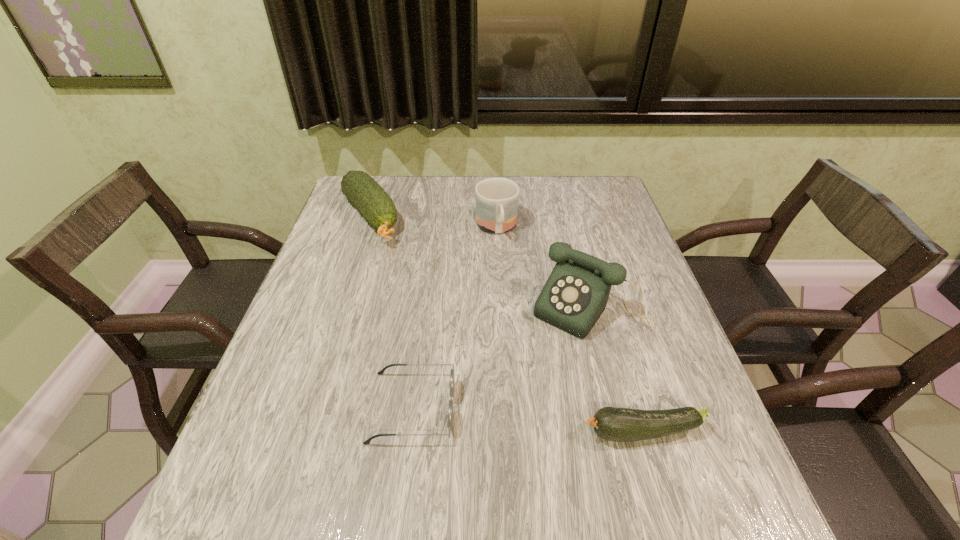
This screenshot has width=960, height=540. I want to click on the fourth object from right to left, so click(x=452, y=374).

Image resolution: width=960 pixels, height=540 pixels. Identify the location of zucchini. (617, 424).

Locate an element on the screen. The height and width of the screenshot is (540, 960). the third object from left to right is located at coordinates [496, 199].

In order to click on the fourth shortest object in this screenshot , I will do `click(496, 199)`.

Find the location of a particular element. Image resolution: width=960 pixels, height=540 pixels. telephone is located at coordinates (575, 295).

Image resolution: width=960 pixels, height=540 pixels. What are the coordinates of `the leftmost object` in the screenshot? It's located at (375, 205).

In order to click on cucumber in this screenshot , I will do `click(375, 205)`.

Where is `free spot located 0.320m on the front-facing side of the fourth object from right to left`? The image size is (960, 540). free spot located 0.320m on the front-facing side of the fourth object from right to left is located at coordinates (615, 407).

Identify the location of vacant region located 0.210m at the blossom end of the zucchini. (469, 432).

The width and height of the screenshot is (960, 540). What are the coordinates of `free space located at the blossom end of the zucchini` in the screenshot? It's located at (474, 432).